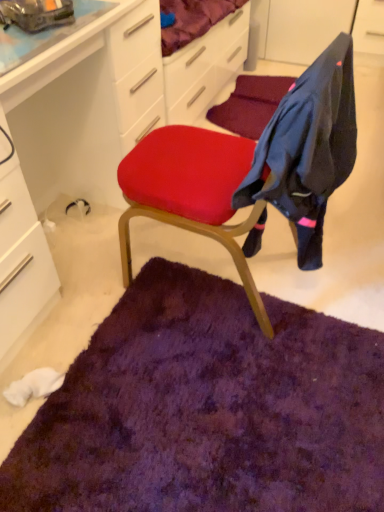
Question: Can you confirm if dark blue fabric at upper right is shorter than purple shaggy rug at center?

Choices:
 (A) no
 (B) yes

Answer: (A)

Question: Could you tell me if dark blue fabric at upper right is turned towards purple shaggy rug at center?

Choices:
 (A) yes
 (B) no

Answer: (B)

Question: Is dark blue fabric at upper right placed right next to purple shaggy rug at center?

Choices:
 (A) yes
 (B) no

Answer: (B)

Question: Can you confirm if dark blue fabric at upper right is smaller than purple shaggy rug at center?

Choices:
 (A) yes
 (B) no

Answer: (B)

Question: Does dark blue fabric at upper right have a lesser width compared to purple shaggy rug at center?

Choices:
 (A) no
 (B) yes

Answer: (B)

Question: Is dark blue fabric at upper right taller or shorter than purple shaggy rug at center?

Choices:
 (A) tall
 (B) short

Answer: (A)

Question: Looking at their shapes, would you say dark blue fabric at upper right is wider or thinner than purple shaggy rug at center?

Choices:
 (A) wide
 (B) thin

Answer: (B)

Question: In the image, is dark blue fabric at upper right on the left side or the right side of purple shaggy rug at center?

Choices:
 (A) right
 (B) left

Answer: (A)

Question: From a real-world perspective, is dark blue fabric at upper right physically located above or below purple shaggy rug at center?

Choices:
 (A) below
 (B) above

Answer: (B)

Question: Based on their positions, is white glossy computer desk at upper left located to the left or right of matte red cushion at center?

Choices:
 (A) left
 (B) right

Answer: (A)

Question: In terms of width, does white glossy computer desk at upper left look wider or thinner when compared to matte red cushion at center?

Choices:
 (A) wide
 (B) thin

Answer: (B)

Question: Is white glossy computer desk at upper left bigger or smaller than matte red cushion at center?

Choices:
 (A) small
 (B) big

Answer: (B)

Question: In terms of height, does white glossy computer desk at upper left look taller or shorter compared to matte red cushion at center?

Choices:
 (A) tall
 (B) short

Answer: (B)

Question: Is white glossy computer desk at upper left bigger or smaller than dark blue fabric at upper right?

Choices:
 (A) big
 (B) small

Answer: (A)

Question: Considering the positions of white glossy computer desk at upper left and dark blue fabric at upper right in the image, is white glossy computer desk at upper left taller or shorter than dark blue fabric at upper right?

Choices:
 (A) tall
 (B) short

Answer: (A)